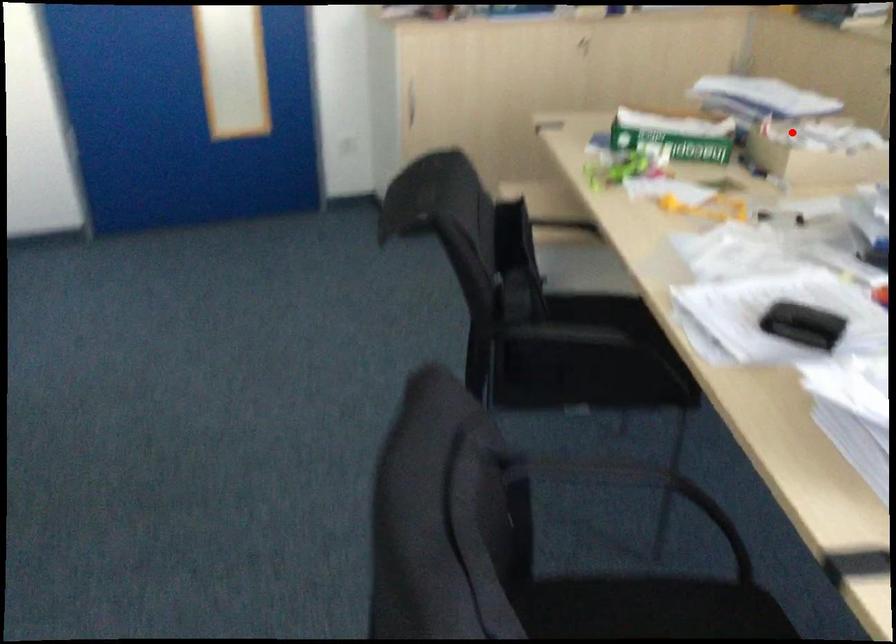
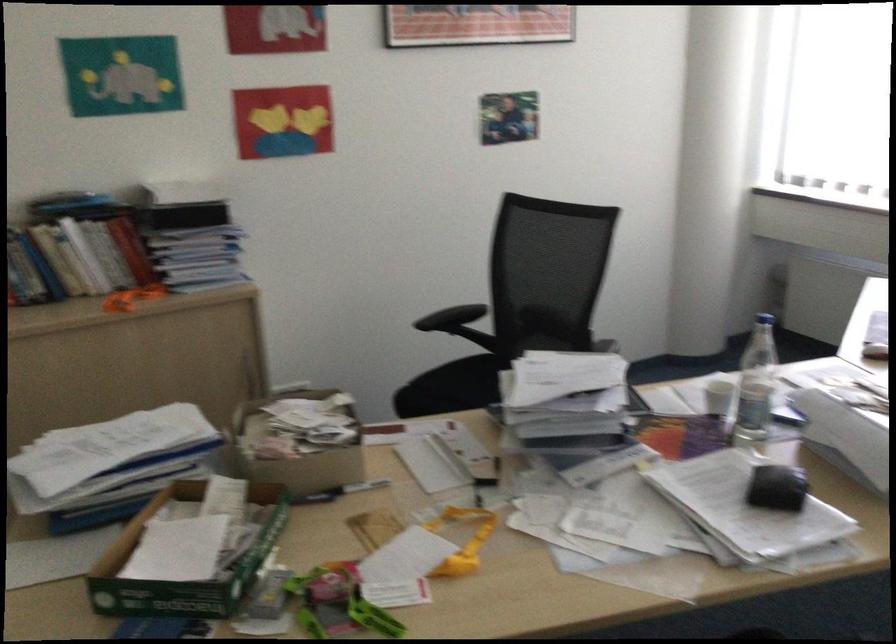
Locate, in the second image, the point that corresponds to the highlighted location in the first image.

(298, 442)